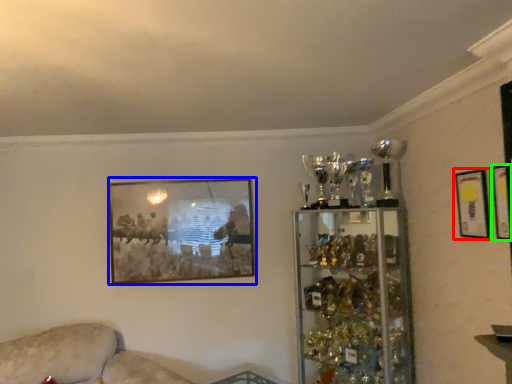
Question: Estimate the real-world distances between objects in this image. Which object is closer to picture frame (highlighted by a red box), picture frame (highlighted by a blue box) or picture frame (highlighted by a green box)?

Choices:
 (A) picture frame
 (B) picture frame

Answer: (B)